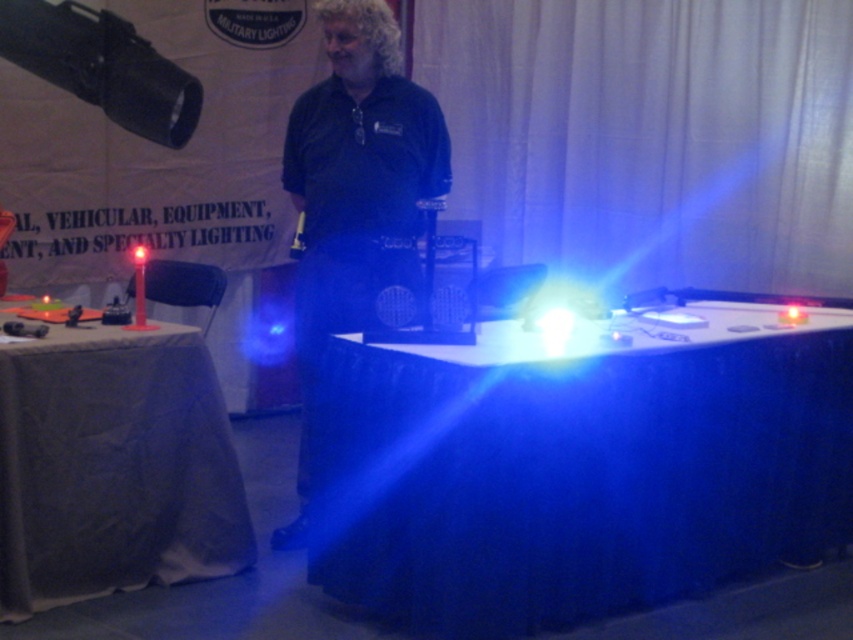
Does blue fabric table at center have a smaller size compared to dark blue shirt at center?

No, blue fabric table at center is not smaller than dark blue shirt at center.

Can you confirm if blue fabric table at center is taller than dark blue shirt at center?

In fact, blue fabric table at center may be shorter than dark blue shirt at center.

Is point (677, 506) positioned behind point (323, 328)?

No, (677, 506) is in front of (323, 328).

At what (x,y) coordinates should I click in order to perform the action: click on blue fabric table at center. Please return your answer as a coordinate pair (x, y). Image resolution: width=853 pixels, height=640 pixels. Looking at the image, I should click on (579, 465).

Between blue fabric table at center and white cloth table at left, which one appears on the left side from the viewer's perspective?

white cloth table at left

How far apart are blue fabric table at center and white cloth table at left?

blue fabric table at center is 37.15 inches away from white cloth table at left.

Does point (676, 493) lie behind point (238, 467)?

No, it is in front of (238, 467).

I want to click on blue fabric table at center, so click(x=579, y=465).

Is white cloth table at left wider than dark blue shirt at center?

Yes, white cloth table at left is wider than dark blue shirt at center.

Is white cloth table at left smaller than dark blue shirt at center?

Yes.

Find the location of `white cloth table at left`. white cloth table at left is located at coordinates (114, 467).